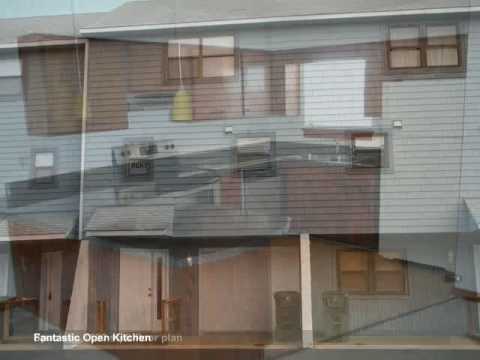
You are a GUI agent. You are given a task and a screenshot of the screen. Output one action in this format:
    pyautogui.click(x=<x>, y=<y>)
    Task: Click on the refrigerator
    
    Given the screenshot: What is the action you would take?
    pyautogui.click(x=432, y=117), pyautogui.click(x=428, y=169), pyautogui.click(x=419, y=244)